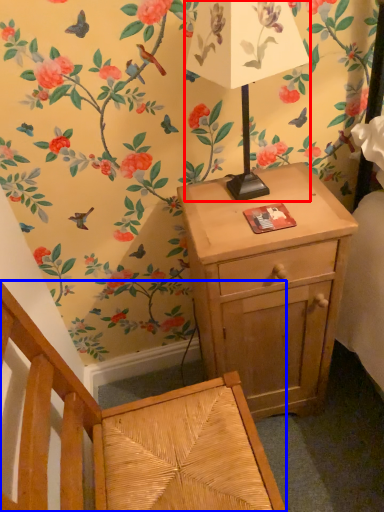
Question: Which point is further to the camera, table lamp (highlighted by a red box) or armchair (highlighted by a blue box)?

Choices:
 (A) table lamp
 (B) armchair

Answer: (A)